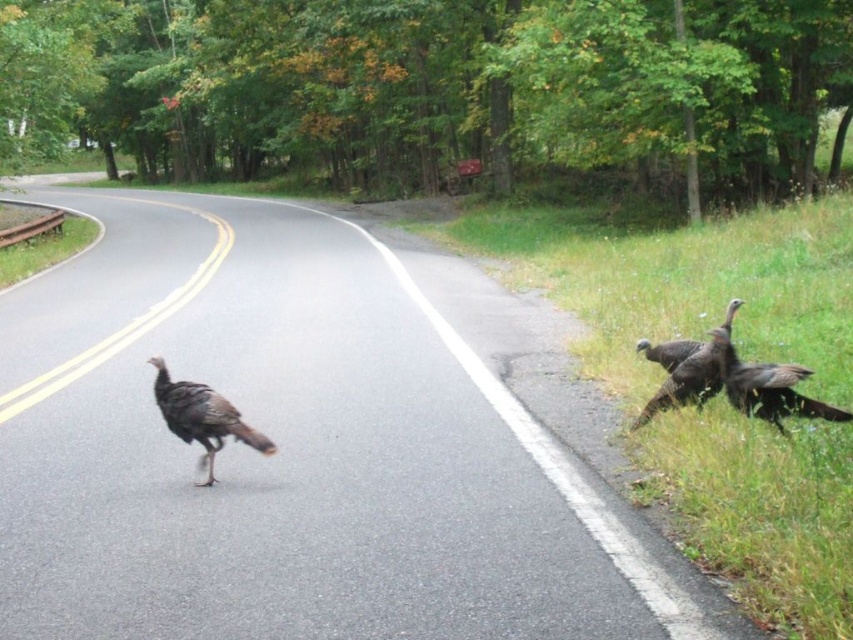
Between point (582, 468) and point (177, 396), which one is positioned in front?

Point (177, 396) is more forward.

Is point (235, 257) positioned before point (213, 413)?

No.

At what (x,y) coordinates should I click in order to perform the action: click on black asphalt highway at center. Please return your answer as a coordinate pair (x, y). Image resolution: width=853 pixels, height=640 pixels. Looking at the image, I should click on point(296,452).

The width and height of the screenshot is (853, 640). Find the location of `black asphalt highway at center`. black asphalt highway at center is located at coordinates (296, 452).

How far apart are brown speckled feathers at road center and dark brown feathers at right?

brown speckled feathers at road center and dark brown feathers at right are 3.37 meters apart from each other.

Is the position of brown speckled feathers at road center less distant than that of dark brown feathers at right?

That is True.

Between point (186, 404) and point (666, 397), which one is positioned in front?

Point (186, 404) is in front.

Locate an element on the screen. The height and width of the screenshot is (640, 853). brown speckled feathers at road center is located at coordinates (202, 417).

Is point (437, 387) closer to viewer compared to point (668, 348)?

No, it is not.

Who is more distant from viewer, (454, 474) or (688, 356)?

The point (688, 356) is behind.

What do you see at coordinates (296, 452) in the screenshot? I see `black asphalt highway at center` at bounding box center [296, 452].

Where is `black asphalt highway at center`? The width and height of the screenshot is (853, 640). black asphalt highway at center is located at coordinates (296, 452).